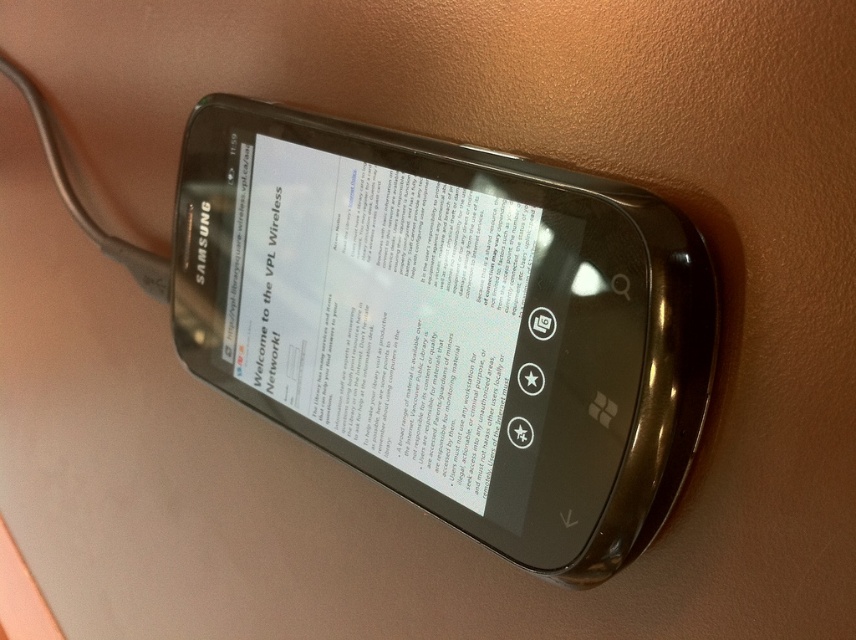
You have a metallic glossy smartphone at center and a white glossy paper at center. You want to place a small sticker between them. Is there enough space to fit the sticker without overlapping either object?

The metallic glossy smartphone at center is 0.92 inches away from white glossy paper at center. Since the sticker is small, it can be placed between them without overlapping either object as there is sufficient space.

You are trying to read the text on the white glossy paper at center but the metallic glossy smartphone at center is blocking your view. Can you see the paper clearly?

The metallic glossy smartphone at center is in front of the white glossy paper at center, so it is blocking the view of the paper making it hard to read the text clearly.

You are holding a 12 inch ruler. You want to measure the distance between yourself and the metallic glossy smartphone at center. Can you do this without moving the ruler? Explain.

The metallic glossy smartphone at center and viewer are 33.21 inches apart. Since the ruler is 12 inches long, you can measure the distance by extending the ruler three full times and then an additional 9.21 inches. However, since the ruler cannot be extended beyond its length without moving it, you can only measure up to 12 inches at a time. Therefore, you would need to move the ruler to measure the full distance.